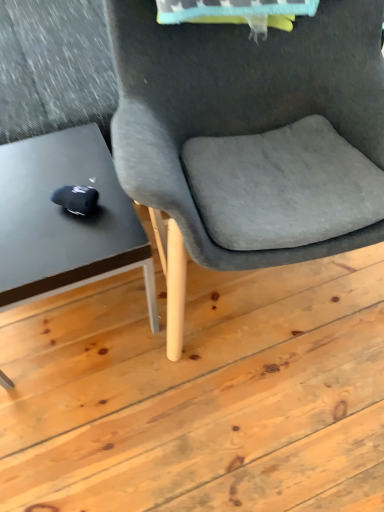
Question: Is suede gray chair at center not near matte black table at left?

Choices:
 (A) yes
 (B) no

Answer: (B)

Question: Is suede gray chair at center not inside matte black table at left?

Choices:
 (A) yes
 (B) no

Answer: (A)

Question: From a real-world perspective, is suede gray chair at center on top of matte black table at left?

Choices:
 (A) no
 (B) yes

Answer: (B)

Question: Can you confirm if suede gray chair at center is positioned to the right of matte black table at left?

Choices:
 (A) no
 (B) yes

Answer: (B)

Question: Does suede gray chair at center lie behind matte black table at left?

Choices:
 (A) no
 (B) yes

Answer: (A)

Question: From a real-world perspective, is suede gray chair at center below matte black table at left?

Choices:
 (A) no
 (B) yes

Answer: (A)

Question: Can you confirm if matte black table at left is positioned to the left of suede gray chair at center?

Choices:
 (A) yes
 (B) no

Answer: (A)

Question: Is matte black table at left at the right side of suede gray chair at center?

Choices:
 (A) yes
 (B) no

Answer: (B)

Question: Could suede gray chair at center be considered to be inside matte black table at left?

Choices:
 (A) no
 (B) yes

Answer: (A)

Question: Are matte black table at left and suede gray chair at center beside each other?

Choices:
 (A) no
 (B) yes

Answer: (A)

Question: Is the position of matte black table at left more distant than that of suede gray chair at center?

Choices:
 (A) yes
 (B) no

Answer: (A)

Question: Is suede gray chair at center at the back of matte black table at left?

Choices:
 (A) no
 (B) yes

Answer: (A)

Question: Would you say matte black table at left is inside or outside suede gray chair at center?

Choices:
 (A) outside
 (B) inside

Answer: (A)